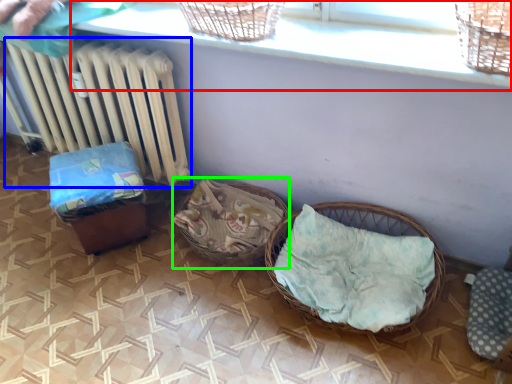
Question: Which is nearer to the window sill (highlighted by a red box)? radiator (highlighted by a blue box) or basket (highlighted by a green box).

Choices:
 (A) radiator
 (B) basket

Answer: (A)